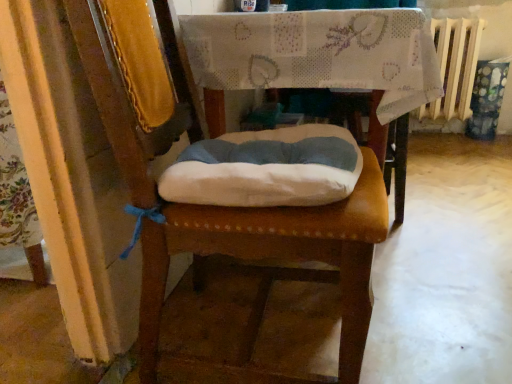
Question: Should I look upward or downward to see leather cushion at center?

Choices:
 (A) down
 (B) up

Answer: (B)

Question: Considering the relative sizes of fabric-covered table at center and leather cushion at center in the image provided, is fabric-covered table at center smaller than leather cushion at center?

Choices:
 (A) yes
 (B) no

Answer: (B)

Question: Is leather cushion at center at the back of fabric-covered table at center?

Choices:
 (A) yes
 (B) no

Answer: (B)

Question: Does fabric-covered table at center have a lesser width compared to leather cushion at center?

Choices:
 (A) no
 (B) yes

Answer: (A)

Question: Does fabric-covered table at center have a lesser height compared to leather cushion at center?

Choices:
 (A) yes
 (B) no

Answer: (A)

Question: Is fabric-covered table at center not close to leather cushion at center?

Choices:
 (A) no
 (B) yes

Answer: (A)

Question: Can you confirm if fabric-covered table at center is wider than leather cushion at center?

Choices:
 (A) no
 (B) yes

Answer: (B)

Question: From the image's perspective, is white painted metal radiator at upper right over leather cushion at center?

Choices:
 (A) yes
 (B) no

Answer: (A)

Question: Considering the relative sizes of white painted metal radiator at upper right and leather cushion at center in the image provided, is white painted metal radiator at upper right bigger than leather cushion at center?

Choices:
 (A) yes
 (B) no

Answer: (B)

Question: Is white painted metal radiator at upper right with leather cushion at center?

Choices:
 (A) no
 (B) yes

Answer: (A)

Question: Does white painted metal radiator at upper right have a greater width compared to leather cushion at center?

Choices:
 (A) yes
 (B) no

Answer: (B)

Question: Is white painted metal radiator at upper right positioned far away from leather cushion at center?

Choices:
 (A) yes
 (B) no

Answer: (A)

Question: From the image's perspective, is white painted metal radiator at upper right beneath leather cushion at center?

Choices:
 (A) yes
 (B) no

Answer: (B)

Question: Can you confirm if leather cushion at center is thinner than fabric-covered table at center?

Choices:
 (A) no
 (B) yes

Answer: (B)